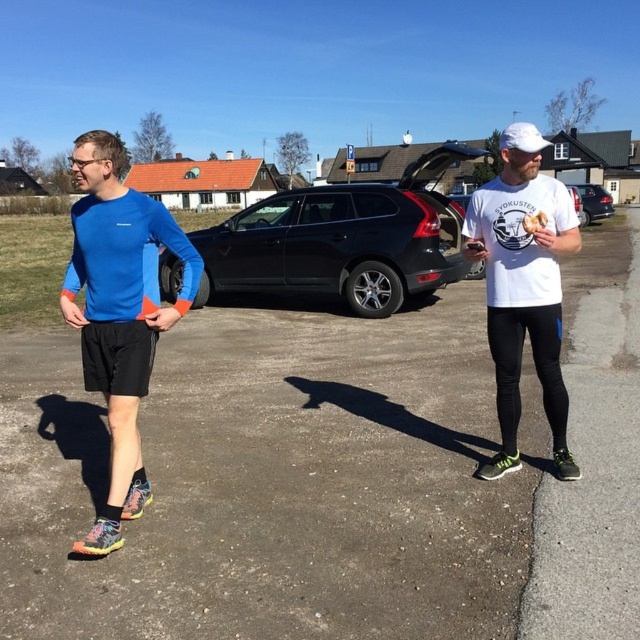
Does point (340, 259) come behind point (556, 420)?

Yes, point (340, 259) is farther from viewer.

Who is shorter, shiny black suv at center or white matte t-shirt at center?

shiny black suv at center

Measure the distance between shiny black suv at center and camera.

shiny black suv at center is 17.51 feet away from camera.

Identify the location of shiny black suv at center. Image resolution: width=640 pixels, height=640 pixels. (336, 246).

Who is positioned more to the right, blue matte running top at left or golden bread at right?

From the viewer's perspective, golden bread at right appears more on the right side.

This screenshot has width=640, height=640. In order to click on blue matte running top at left in this screenshot , I will do `click(120, 312)`.

Is metallic silver hatchback at center wider than golden bread at right?

Yes, metallic silver hatchback at center is wider than golden bread at right.

The height and width of the screenshot is (640, 640). Describe the element at coordinates (592, 202) in the screenshot. I see `metallic silver hatchback at center` at that location.

Is point (589, 202) closer to camera compared to point (545, 224)?

No, it is behind (545, 224).

Where is `metallic silver hatchback at center`? metallic silver hatchback at center is located at coordinates (592, 202).